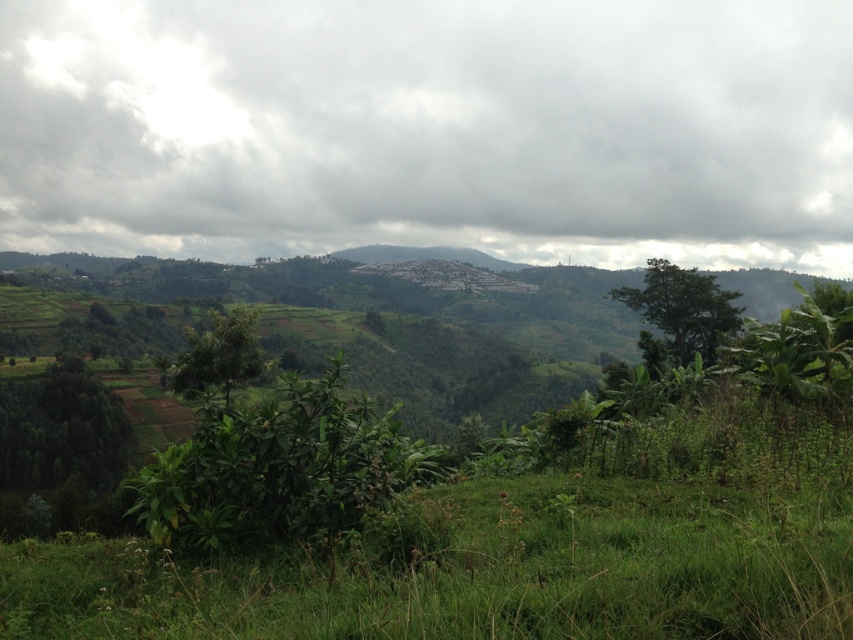
Is cloudy sky at upper center positioned before green leafy bush at center?

No, cloudy sky at upper center is behind green leafy bush at center.

Is cloudy sky at upper center positioned behind green leafy bush at center?

Yes, it is behind green leafy bush at center.

Image resolution: width=853 pixels, height=640 pixels. What do you see at coordinates (430, 129) in the screenshot? I see `cloudy sky at upper center` at bounding box center [430, 129].

The image size is (853, 640). What are the coordinates of `cloudy sky at upper center` in the screenshot? It's located at (430, 129).